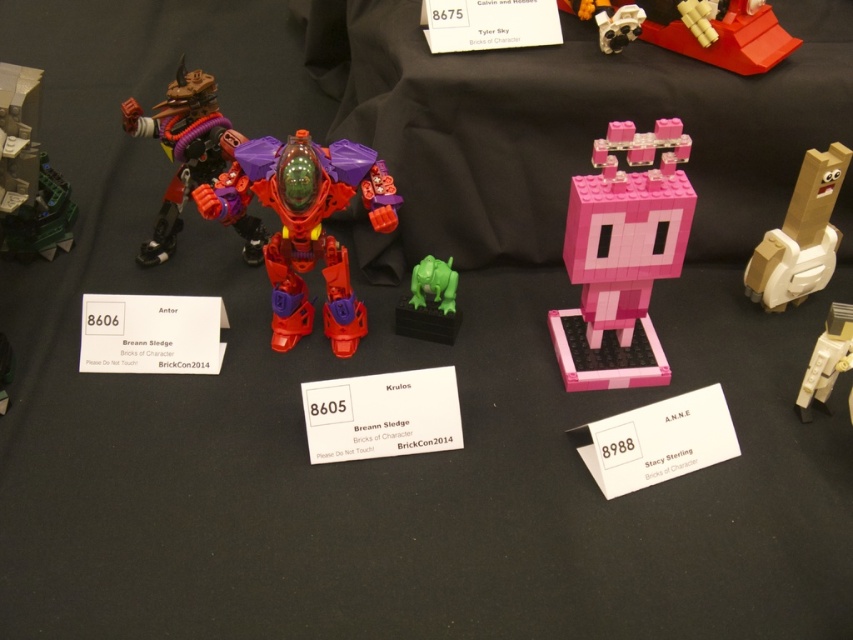
Find the location of a particular element. Image resolution: width=853 pixels, height=640 pixels. pink matte blocky figure at center is located at coordinates (622, 257).

I want to click on pink matte blocky figure at center, so click(x=622, y=257).

Between point (265, 250) and point (648, 35), which one is positioned behind?

Positioned behind is point (648, 35).

The image size is (853, 640). What are the coordinates of `matte plastic robot at center` in the screenshot? It's located at (305, 225).

Consider the image. Between matte plastic robot at center and green rubbery monster at center, which one has more height?

matte plastic robot at center

Who is lower down, matte plastic robot at center or green rubbery monster at center?

green rubbery monster at center

Is point (311, 225) more distant than point (425, 330)?

No, it is not.

Where is `matte plastic robot at center`? The width and height of the screenshot is (853, 640). matte plastic robot at center is located at coordinates (305, 225).